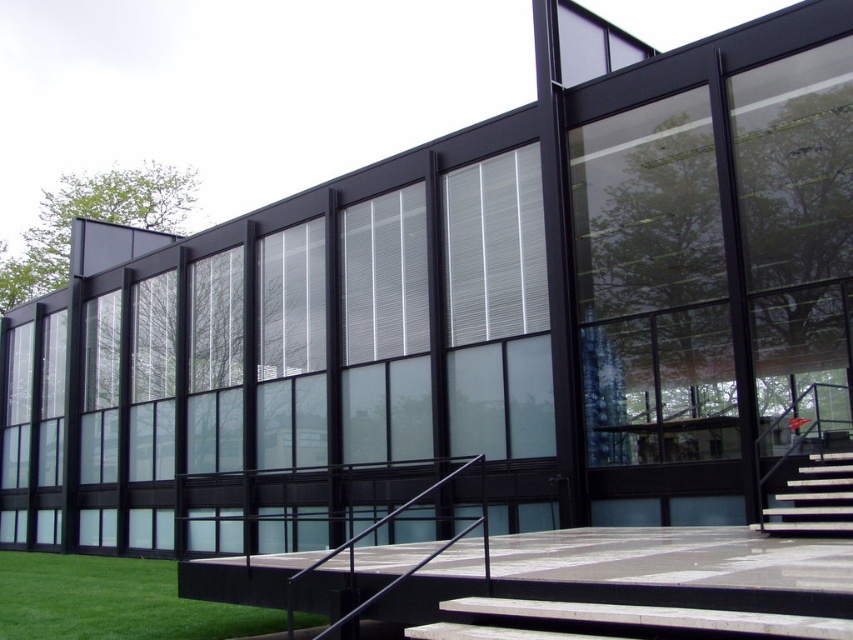
You are standing in front of the modern building and want to find the green grass at lower left. Based on the coordinates provided, where should you look relative to the building?

The green grass at lower left is located at coordinates point [112,602], which means it is positioned to the far right and lower part of the image relative to the building.